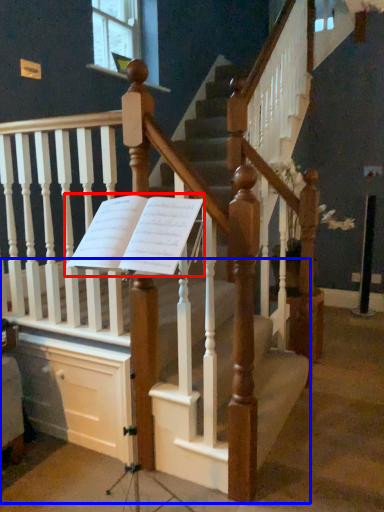
Question: Which object is further to the camera taking this photo, sheet music (highlighted by a red box) or stairs (highlighted by a blue box)?

Choices:
 (A) sheet music
 (B) stairs

Answer: (A)